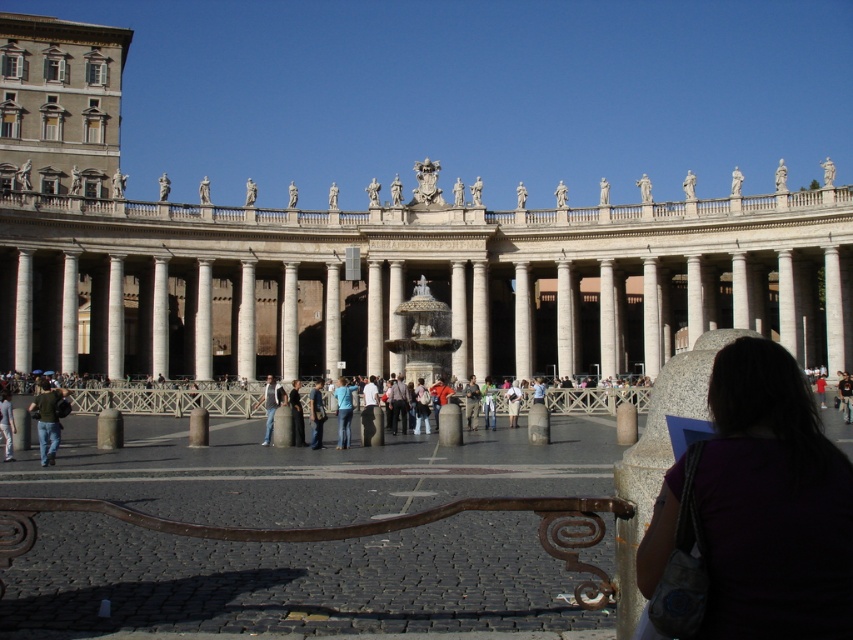
Question: Considering the real-world distances, which object is closest to the denim jeans at center?

Choices:
 (A) white marble palace at center
 (B) denim jacket at center
 (C) dark blue dress at center

Answer: (C)

Question: Which of the following is the closest to the observer?

Choices:
 (A) (276, 394)
 (B) (299, 392)
 (C) (782, 275)
 (D) (485, 412)

Answer: (C)

Question: From the image, what is the correct spatial relationship of denim jeans at center in relation to dark blue dress at center?

Choices:
 (A) below
 (B) above

Answer: (B)

Question: In this image, where is white marble palace at center located relative to green fabric jacket at lower left?

Choices:
 (A) above
 (B) below

Answer: (A)

Question: Among these points, which one is farthest from the camera?

Choices:
 (A) (341, 396)
 (B) (268, 412)

Answer: (B)

Question: Is white marble palace at center to the left of purple fabric at lower right from the viewer's perspective?

Choices:
 (A) yes
 (B) no

Answer: (A)